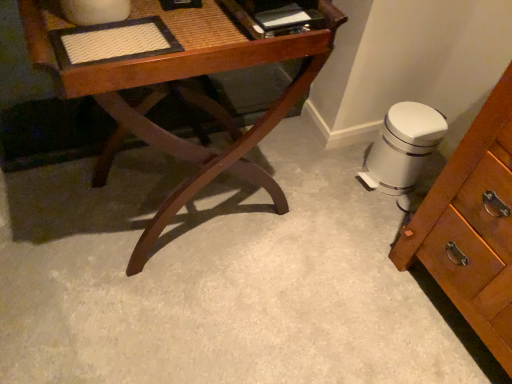
The height and width of the screenshot is (384, 512). What are the coordinates of `vacant area situated below glossy wood desk at center (from a real-world perspective)` in the screenshot? It's located at (176, 213).